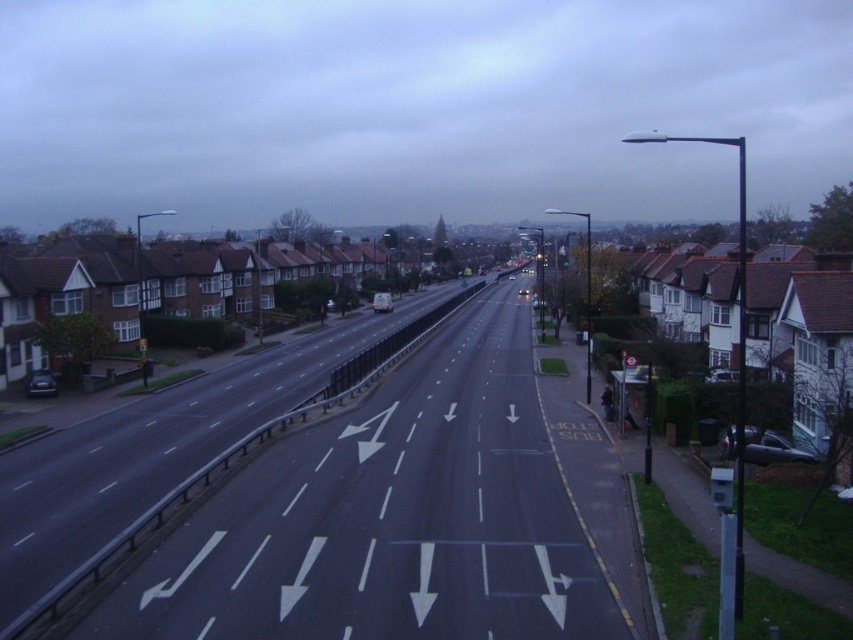
Which is more to the right, matte black car at left or metallic silver car at center?

From the viewer's perspective, metallic silver car at center appears more on the right side.

Describe the element at coordinates (41, 384) in the screenshot. I see `matte black car at left` at that location.

The height and width of the screenshot is (640, 853). Find the location of `matte black car at left`. matte black car at left is located at coordinates (41, 384).

Does black asphalt highway at center have a greater width compared to metallic silver car at center?

Correct, the width of black asphalt highway at center exceeds that of metallic silver car at center.

Is point (144, 588) farther from camera compared to point (735, 369)?

No, it is in front of (735, 369).

Is point (363, 621) farther from camera compared to point (726, 371)?

No, (363, 621) is in front of (726, 371).

You are a GUI agent. You are given a task and a screenshot of the screen. Output one action in this format:
    pyautogui.click(x=<x>, y=<y>)
    Task: Click on the black asphalt highway at center
    The image size is (853, 640).
    Given the screenshot: What is the action you would take?
    pyautogui.click(x=401, y=515)

Is black asphalt highway at center to the left of matte black car at left from the viewer's perspective?

Incorrect, black asphalt highway at center is not on the left side of matte black car at left.

Identify the location of black asphalt highway at center. The height and width of the screenshot is (640, 853). (401, 515).

This screenshot has width=853, height=640. In order to click on black asphalt highway at center in this screenshot , I will do pos(401,515).

Identify the location of black asphalt highway at center. (401, 515).